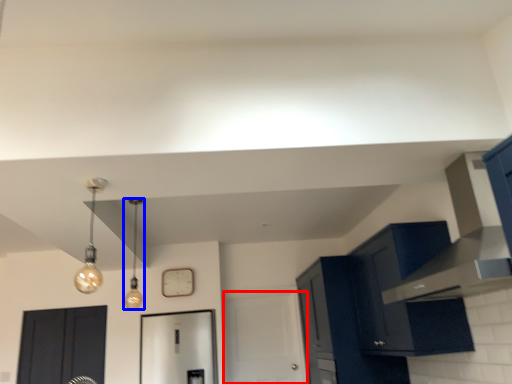
Question: Which point is closer to the camera, door (highlighted by a red box) or light fixture (highlighted by a blue box)?

Choices:
 (A) door
 (B) light fixture

Answer: (B)